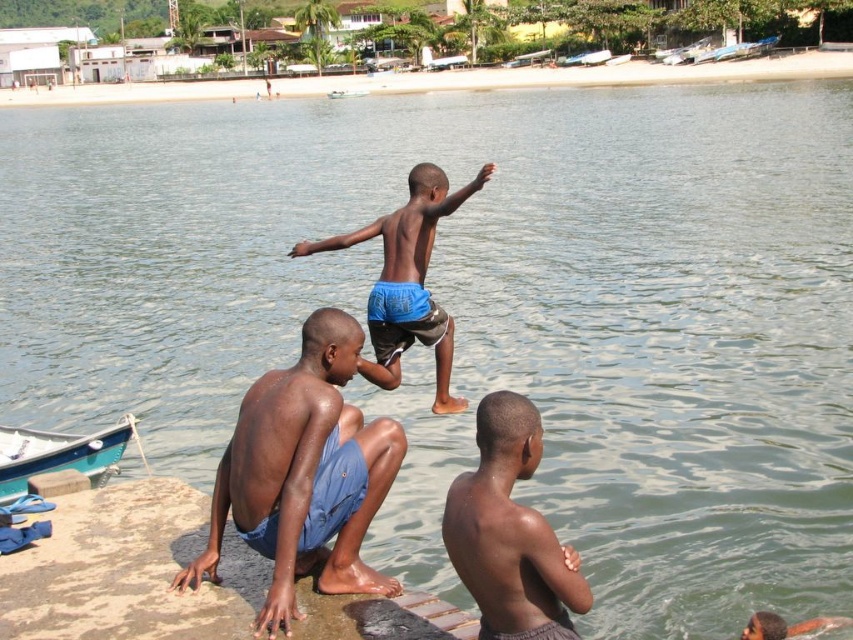
Which is below, blue cotton shorts at lower left or blue shorts at center?

blue cotton shorts at lower left is lower down.

Is blue cotton shorts at lower left to the left of blue shorts at center from the viewer's perspective?

Yes, blue cotton shorts at lower left is to the left of blue shorts at center.

Is point (323, 358) positioned after point (401, 291)?

No, it is in front of (401, 291).

The image size is (853, 640). I want to click on blue cotton shorts at lower left, so click(305, 474).

Does dry skin at lower right have a lesser height compared to teal plastic boat at center?

In fact, dry skin at lower right may be taller than teal plastic boat at center.

Find the location of a particular element. This screenshot has height=640, width=853. dry skin at lower right is located at coordinates (509, 532).

Does point (517, 605) lie behind point (343, 93)?

No.

At what (x,y) coordinates should I click in order to perform the action: click on dry skin at lower right. Please return your answer as a coordinate pair (x, y). The height and width of the screenshot is (640, 853). Looking at the image, I should click on (509, 532).

Which is below, blue cotton shorts at lower left or teal wooden boat at lower left?

Positioned lower is teal wooden boat at lower left.

Is point (345, 412) closer to viewer compared to point (18, 480)?

Yes.

Which is behind, point (285, 531) or point (9, 451)?

The point (9, 451) is more distant.

At what (x,y) coordinates should I click in order to perform the action: click on blue cotton shorts at lower left. Please return your answer as a coordinate pair (x, y). The width and height of the screenshot is (853, 640). Looking at the image, I should click on (305, 474).